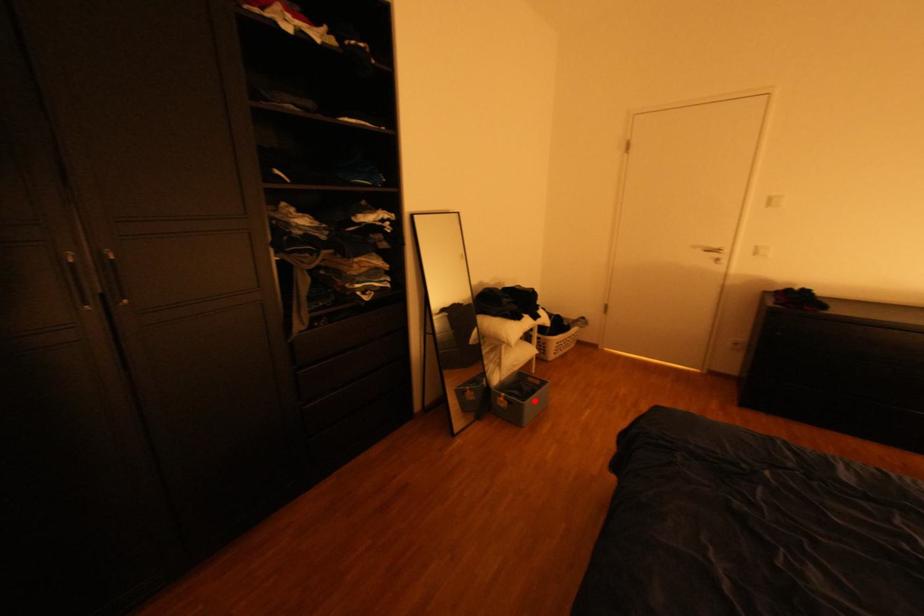
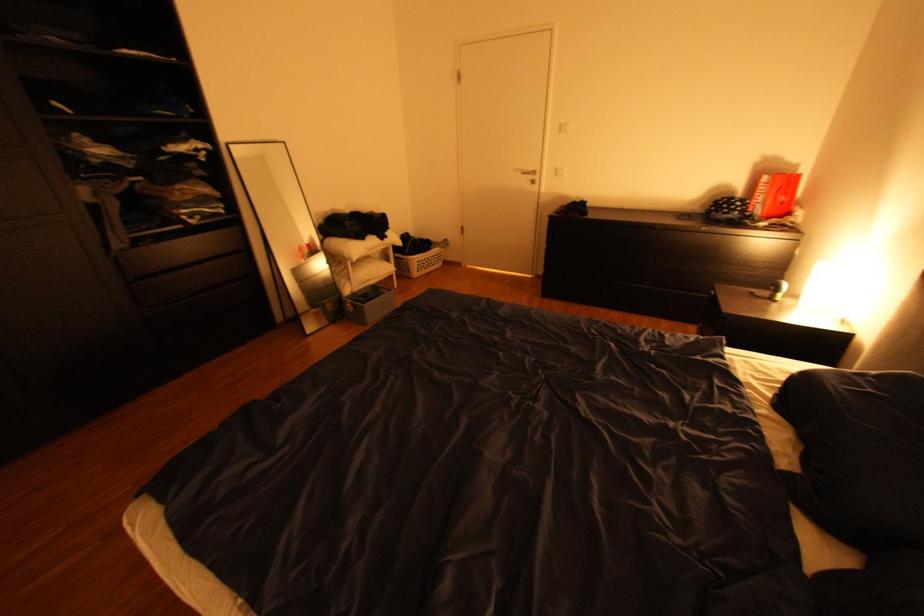
Question: I am providing you with two images of the same scene from different viewpoints. Given a red point in image1, look at the same physical point in image2. Is it:

Choices:
 (A) Closer to the viewpoint
 (B) Farther from the viewpoint

Answer: (B)